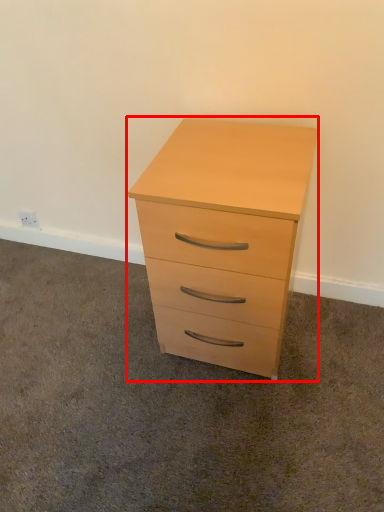
Question: From the image's perspective, what is the correct spatial relationship of chest of drawers (annotated by the red box) in relation to plain?

Choices:
 (A) below
 (B) above

Answer: (B)